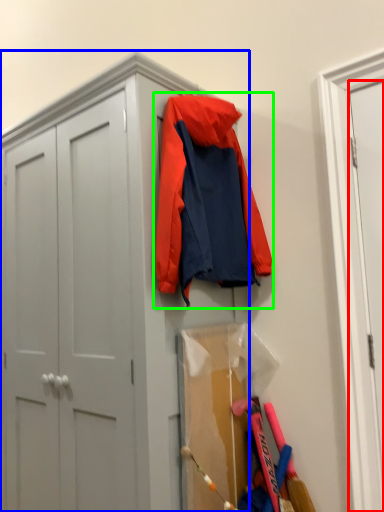
Question: Which object is the farthest from door (highlighted by a red box)? Choose among these: cabinetry (highlighted by a blue box) or jacket (highlighted by a green box).

Choices:
 (A) cabinetry
 (B) jacket

Answer: (A)